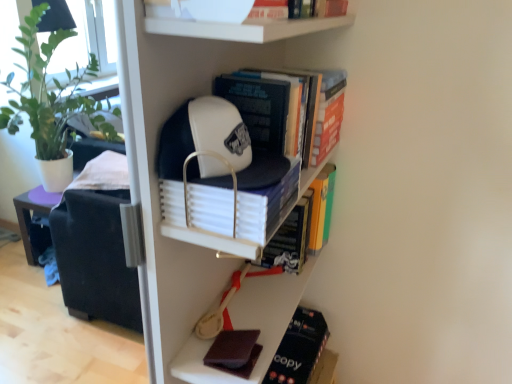
You are a GUI agent. You are given a task and a screenshot of the screen. Output one action in this format:
    pyautogui.click(x=<x>, y=<y>)
    Task: Click on the vacant area on top of white matte book at center, positioned as the 4th book in top-to-bottom order (from a real-world perspective)
    This screenshot has width=512, height=384.
    Given the screenshot: What is the action you would take?
    pyautogui.click(x=248, y=169)